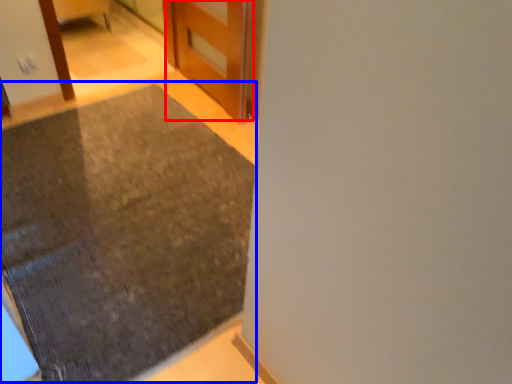
Question: Which point is closer to the camera, door (highlighted by a red box) or mat (highlighted by a blue box)?

Choices:
 (A) door
 (B) mat

Answer: (B)